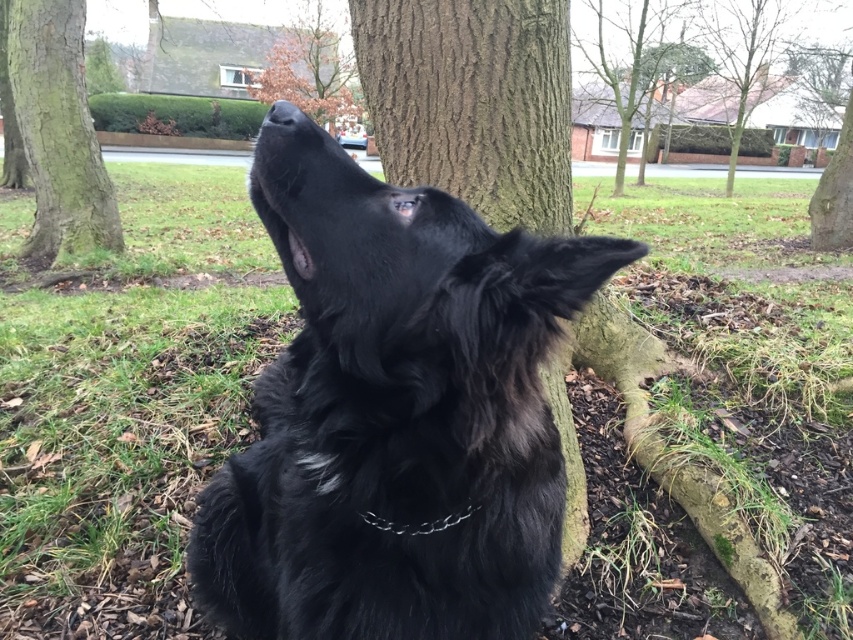
Based on the photo, measure the distance between brown rough tree trunk at upper center and camera.

brown rough tree trunk at upper center and camera are 74.64 feet apart.

At what (x,y) coordinates should I click in order to perform the action: click on brown rough tree trunk at upper center. Please return your answer as a coordinate pair (x, y). This screenshot has height=640, width=853. Looking at the image, I should click on (631, 60).

Is black furry dog at center to the right of brown rough tree at upper center from the viewer's perspective?

Yes, black furry dog at center is to the right of brown rough tree at upper center.

Who is more forward, (321, 499) or (285, 58)?

Positioned in front is point (321, 499).

Describe the element at coordinates (393, 413) in the screenshot. Image resolution: width=853 pixels, height=640 pixels. I see `black furry dog at center` at that location.

This screenshot has width=853, height=640. Identify the location of black furry dog at center. (393, 413).

Does brown rough tree trunk at upper center appear on the left side of metallic chain at center?

Incorrect, brown rough tree trunk at upper center is not on the left side of metallic chain at center.

Measure the distance between point [666,42] and camera.

A distance of 24.29 meters exists between point [666,42] and camera.

Find the location of a particular element. The image size is (853, 640). brown rough tree trunk at upper center is located at coordinates (631, 60).